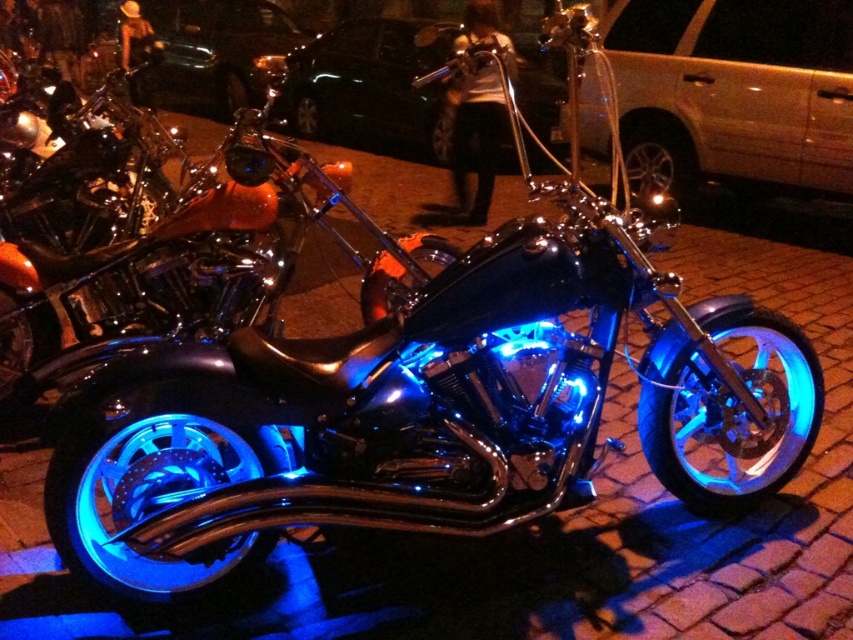
Question: Is metallic gold van at center smaller than glossy black car at upper center?

Choices:
 (A) no
 (B) yes

Answer: (B)

Question: Is metallic gold van at center to the left of glossy black car at upper center from the viewer's perspective?

Choices:
 (A) yes
 (B) no

Answer: (B)

Question: Which object appears closest to the camera in this image?

Choices:
 (A) black metallic car at center
 (B) blue illuminated chrome motorcycle at center
 (C) glossy black car at upper center
 (D) metallic gold van at center

Answer: (B)

Question: Does blue illuminated chrome motorcycle at center appear on the left side of metallic gold van at center?

Choices:
 (A) yes
 (B) no

Answer: (A)

Question: Estimate the real-world distances between objects in this image. Which object is closer to the glossy black car at upper center?

Choices:
 (A) blue illuminated chrome motorcycle at center
 (B) black metallic car at center
 (C) metallic gold van at center

Answer: (B)

Question: Estimate the real-world distances between objects in this image. Which object is closer to the metallic gold van at center?

Choices:
 (A) glossy black car at upper center
 (B) black metallic car at center

Answer: (B)